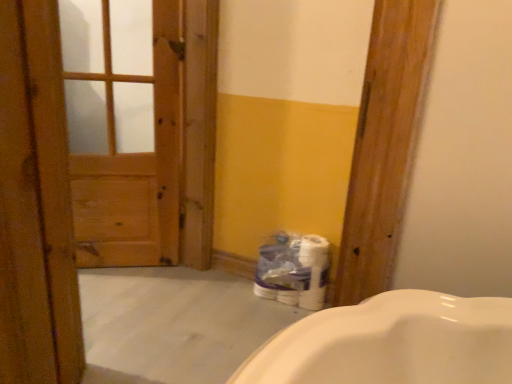
This screenshot has height=384, width=512. I want to click on free point behind wooden door at left, so click(174, 287).